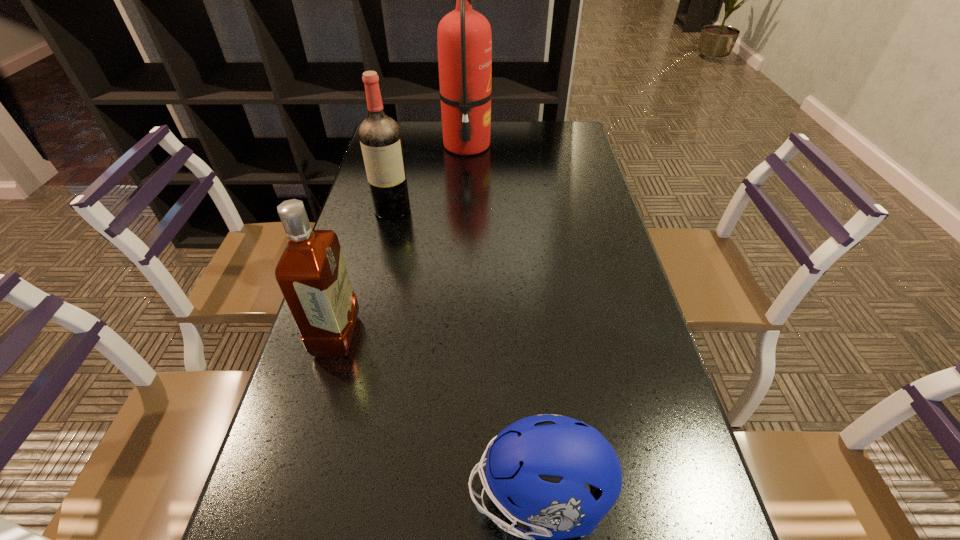
In the image, there is a desktop. At what (x,y) coordinates should I click in order to perform the action: click on vacant space at the far right corner. Please return your answer as a coordinate pair (x, y). Looking at the image, I should click on (572, 141).

This screenshot has height=540, width=960. Find the location of `vacant space in between the nearer liquor and the second farthest object`. vacant space in between the nearer liquor and the second farthest object is located at coordinates (365, 273).

Where is `free point between the farthest object and the nearer liquor`? The width and height of the screenshot is (960, 540). free point between the farthest object and the nearer liquor is located at coordinates coord(401,241).

You are a GUI agent. You are given a task and a screenshot of the screen. Output one action in this format:
    pyautogui.click(x=<x>, y=<y>)
    Task: Click on the free space between the farther liquor and the farthest object
    Image resolution: width=960 pixels, height=540 pixels.
    Given the screenshot: What is the action you would take?
    pyautogui.click(x=430, y=178)

Locate an element on the screen. free space that is in between the farther liquor and the tallest object is located at coordinates (430, 178).

Locate an element on the screen. free point between the nearer liquor and the farthest object is located at coordinates (401, 241).

The width and height of the screenshot is (960, 540). What are the coordinates of `object that is the third closest to the farther liquor` in the screenshot? It's located at (536, 469).

Choose which object is the nearest neighbor to the nearest object. Please provide its 2D coordinates. Your answer should be formatted as a tuple, i.e. [(x, y)], where the tuple contains the x and y coordinates of a point satisfying the conditions above.

[(312, 275)]

What are the coordinates of `vacant region that satisfies the following two spatial constraints: 1. on the side of the farthest object with the nozzle and handle; 2. on the front-facing side of the second farthest object` in the screenshot? It's located at (464, 210).

You are a GUI agent. You are given a task and a screenshot of the screen. Output one action in this format:
    pyautogui.click(x=<x>, y=<y>)
    Task: Click on the free space in the image that satisfies the following two spatial constraints: 1. on the front-facing side of the third nearest object; 2. on the front label of the nearer liquor
    This screenshot has height=540, width=960.
    Given the screenshot: What is the action you would take?
    pyautogui.click(x=363, y=336)